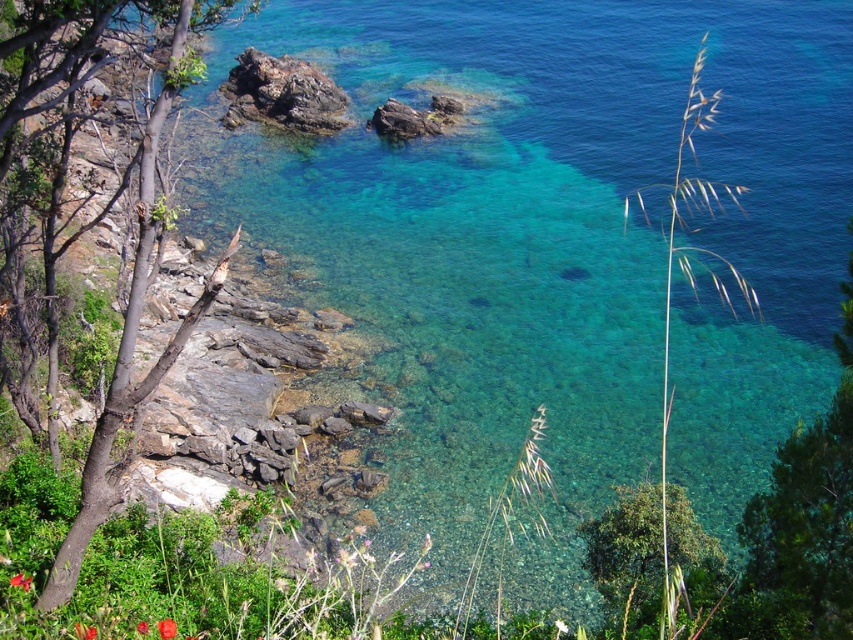
You are a gardener who wants to plant a new flower between the red matte flower at lower left and the smooth glossy rose at center. The new flower requires a space of 18 inches between it and each existing flower. Is there enough space for it?

The distance between the red matte flower at lower left and the smooth glossy rose at center is 20.84 inches. Since the new flower needs 18 inches of space from each existing flower, the total required space would be 18 x 2 inches, which is 36 inches. However, the available space is only 20.84 inches, so there isn not enough space to plant the new flower between them.

You are a photographer standing at the edge of the rocky shoreline. You want to take a photo that includes both the point at position (689, 540) and the point at position (96, 630). Which point is closer to your camera lens?

Point (96, 630) is closer to the camera lens because it is positioned nearer to the viewer compared to point (689, 540), which is further away.